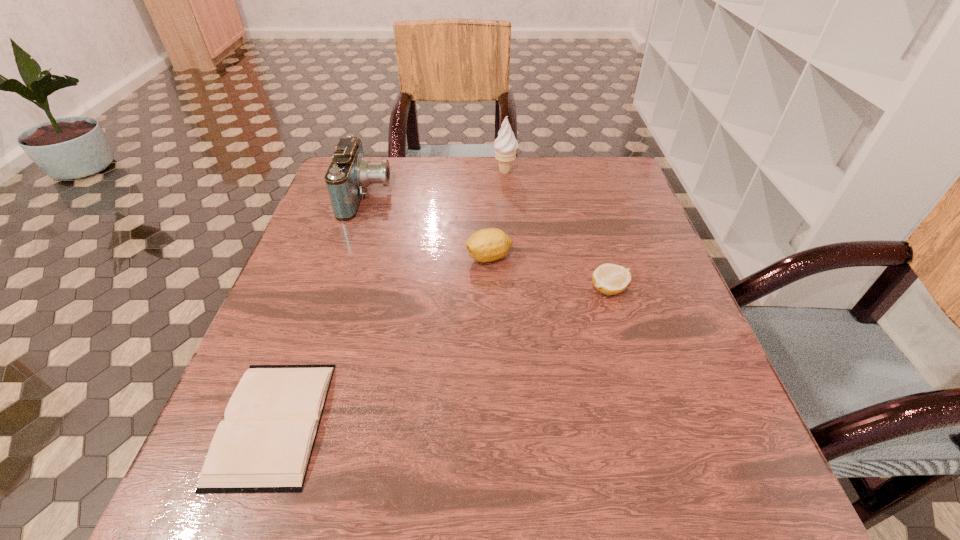
In order to click on free region that satisfies the following two spatial constraints: 1. on the front-facing side of the tallest object; 2. on the front-facing side of the camcorder in this screenshot , I will do `click(507, 197)`.

Identify the location of vacant space that satisfies the following two spatial constraints: 1. at the stem end of the rightmost object; 2. on the right side of the third nearest object. (490, 289).

This screenshot has height=540, width=960. I want to click on vacant space that satisfies the following two spatial constraints: 1. on the front-facing side of the tallest object; 2. on the front-facing side of the camcorder, so click(x=507, y=197).